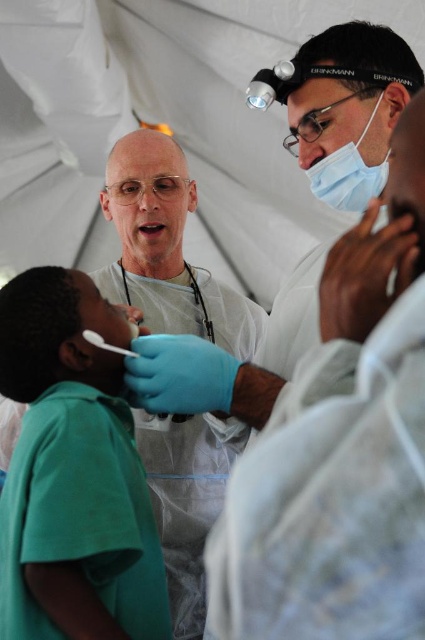
You are a medical student observing a procedure and need to document the positions of the green matte shirt at lower left and white matte gloves at center. Which object is located lower in the image?

The green matte shirt at lower left is positioned under the white matte gloves at center, so it is located lower in the image.